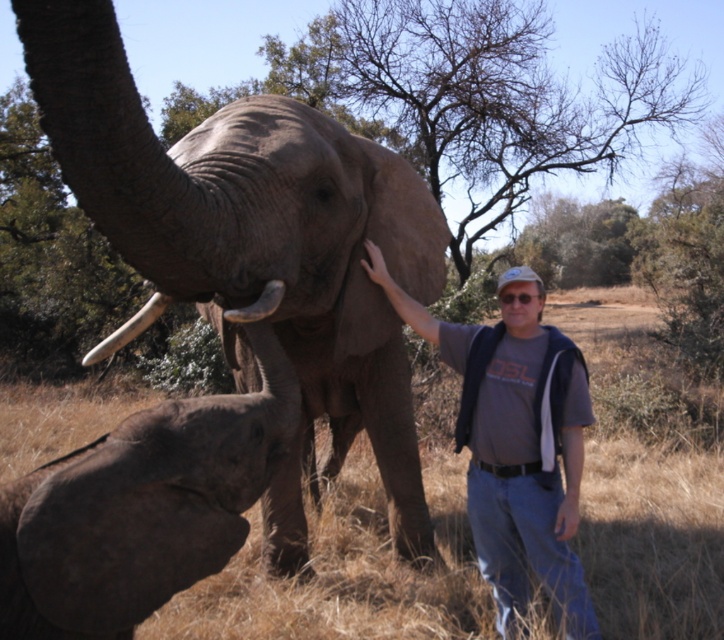
You are a wildlife photographer aiming to capture a closeup shot of the gray textured elephant at center and the white ivory tusk at center. Given their sizes, which one should you zoom in on more to ensure both are clearly visible in the photo?

The gray textured elephant at center is larger than the white ivory tusk at center, so you should zoom in more on the gray textured elephant at center to ensure both are clearly visible in the photo.

You are a wildlife photographer aiming to capture the gray fabric shirt at center and the white ivory tusk at upper left in a single frame. Based on their heights, which object should you focus on first to ensure both are in focus?

The gray fabric shirt at center has a greater height compared to the white ivory tusk at upper left. To ensure both are in focus, you should focus on the taller object first, which is the gray fabric shirt at center.